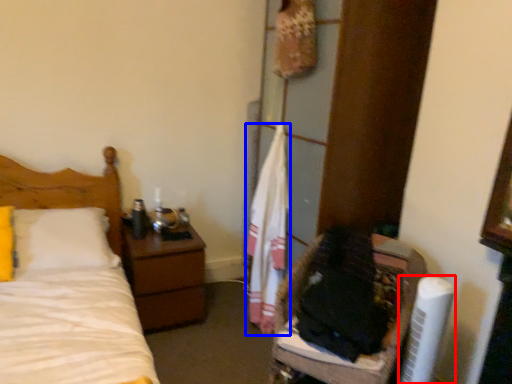
Question: Which object appears closest to the camera in this image, air conditioner (highlighted by a red box) or clothe (highlighted by a blue box)?

Choices:
 (A) air conditioner
 (B) clothe

Answer: (A)